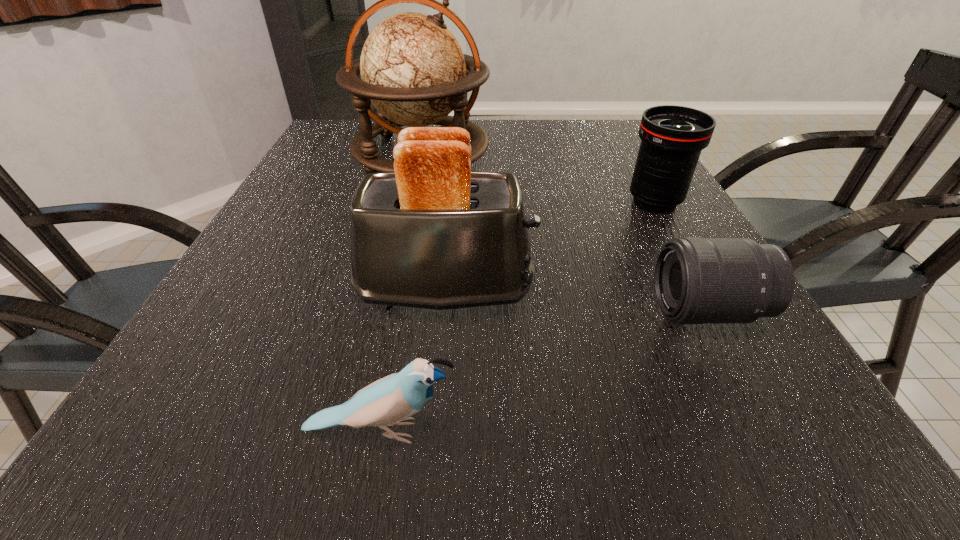
Locate an element on the screen. This screenshot has height=540, width=960. free space between the toaster and the nearer telephoto lens is located at coordinates (576, 301).

I want to click on free space between the farthest object and the nearer telephoto lens, so click(564, 232).

Locate an element on the screen. The image size is (960, 540). empty location between the third tallest object and the bird is located at coordinates (517, 316).

This screenshot has height=540, width=960. Find the location of `unoccupied position between the shorter telephoto lens and the globe`. unoccupied position between the shorter telephoto lens and the globe is located at coordinates (564, 232).

Locate an element on the screen. This screenshot has width=960, height=540. unoccupied position between the fourth shortest object and the bird is located at coordinates (413, 360).

Identify which object is the fourth closest to the fourth nearest object. Please provide its 2D coordinates. Your answer should be formatted as a tuple, i.e. [(x, y)], where the tuple contains the x and y coordinates of a point satisfying the conditions above.

[(390, 401)]

Locate which object ranks third in proximity to the farthest object. Please provide its 2D coordinates. Your answer should be formatted as a tuple, i.e. [(x, y)], where the tuple contains the x and y coordinates of a point satisfying the conditions above.

[(697, 280)]

This screenshot has height=540, width=960. Identify the location of free region that satisfies the following two spatial constraints: 1. on the front side of the second farthest object; 2. on the surface of the shorter telephoto lens. (716, 311).